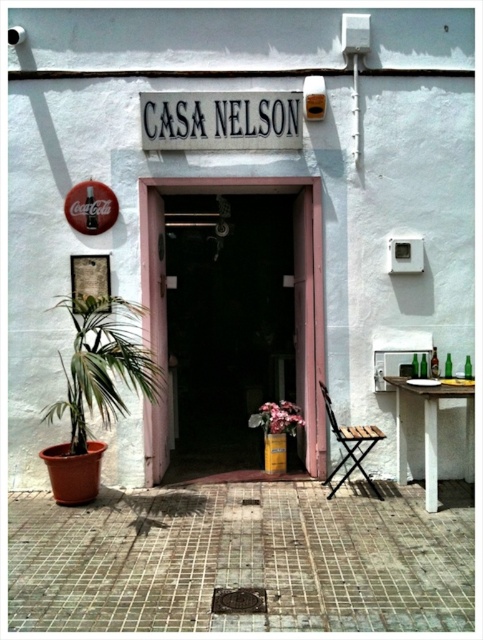
In the scene shown: Can you confirm if green leafy plant at left is positioned below pink matte flower at center?

No.

Does green leafy plant at left have a lesser width compared to pink matte flower at center?

In fact, green leafy plant at left might be wider than pink matte flower at center.

What do you see at coordinates (102, 364) in the screenshot? I see `green leafy plant at left` at bounding box center [102, 364].

Where is `green leafy plant at left`? green leafy plant at left is located at coordinates (102, 364).

Who is positioned more to the left, white wooden table at lower right or pink matte flower at center?

pink matte flower at center is more to the left.

Who is more forward, [429,449] or [284,406]?

Positioned in front is point [429,449].

Identify the location of white wooden table at lower right. (431, 429).

Does green leafy plant at left appear on the left side of white wooden table at lower right?

Yes, green leafy plant at left is to the left of white wooden table at lower right.

Where is `green leafy plant at left`? The width and height of the screenshot is (483, 640). green leafy plant at left is located at coordinates (102, 364).